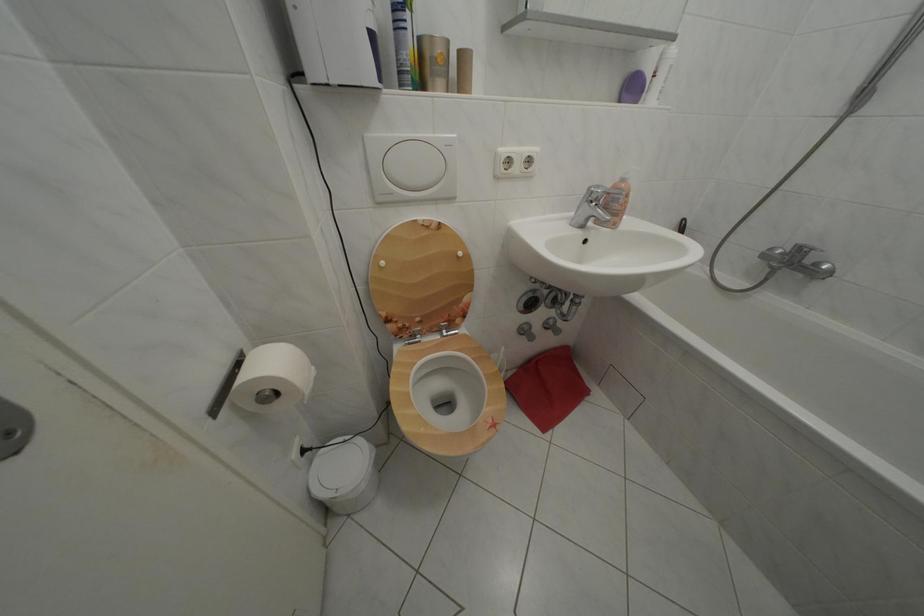
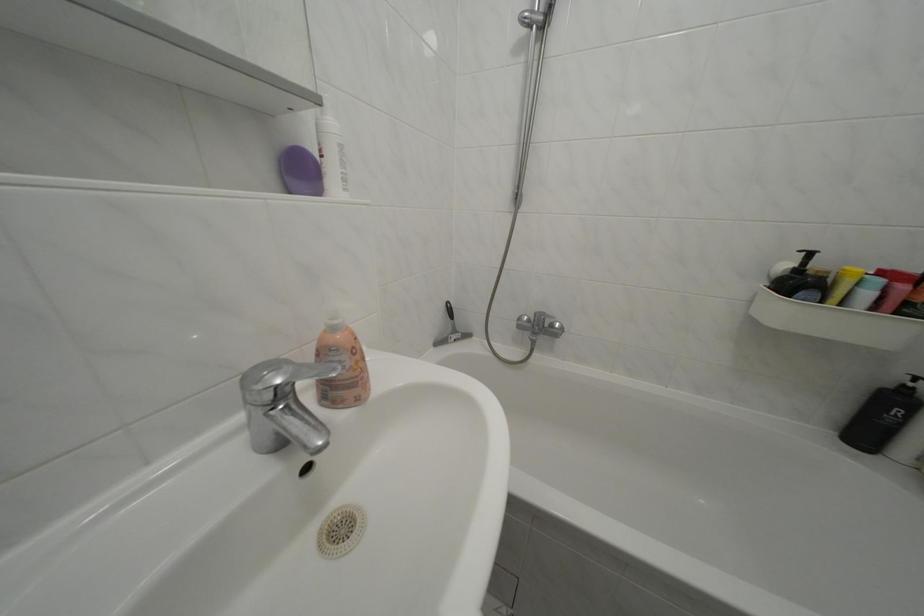
Question: I am providing you with two images of the same scene from different viewpoints. After the viewpoint changes to image2, which objects are now occluded?

Choices:
 (A) soap dispenser pump
 (B) silver faucet handle
 (C) faucet diverter knob
 (D) none of these

Answer: (D)